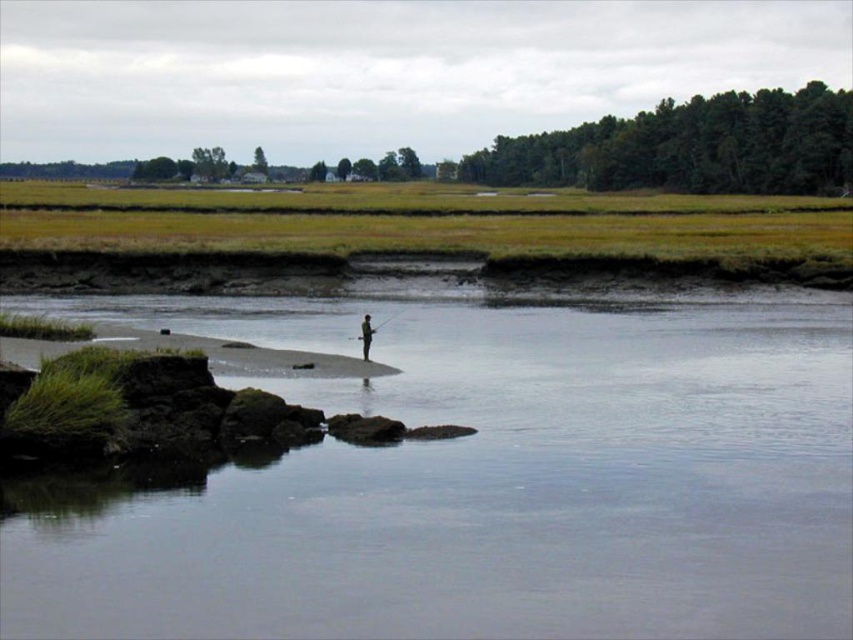
Is clear water at center positioned behind light brown wooden pole at center?

No.

Is clear water at center closer to the viewer compared to light brown wooden pole at center?

Yes, it is in front of light brown wooden pole at center.

Does point (302, 561) come closer to viewer compared to point (368, 356)?

Yes.

At what (x,y) coordinates should I click in order to perform the action: click on clear water at center. Please return your answer as a coordinate pair (x, y). The width and height of the screenshot is (853, 640). Looking at the image, I should click on (486, 474).